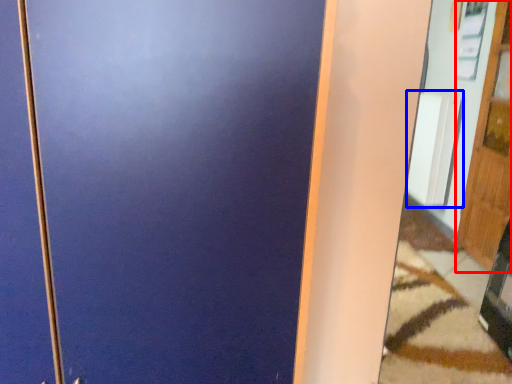
Question: Which point is closer to the camera, door (highlighted by a red box) or radiator (highlighted by a blue box)?

Choices:
 (A) door
 (B) radiator

Answer: (A)